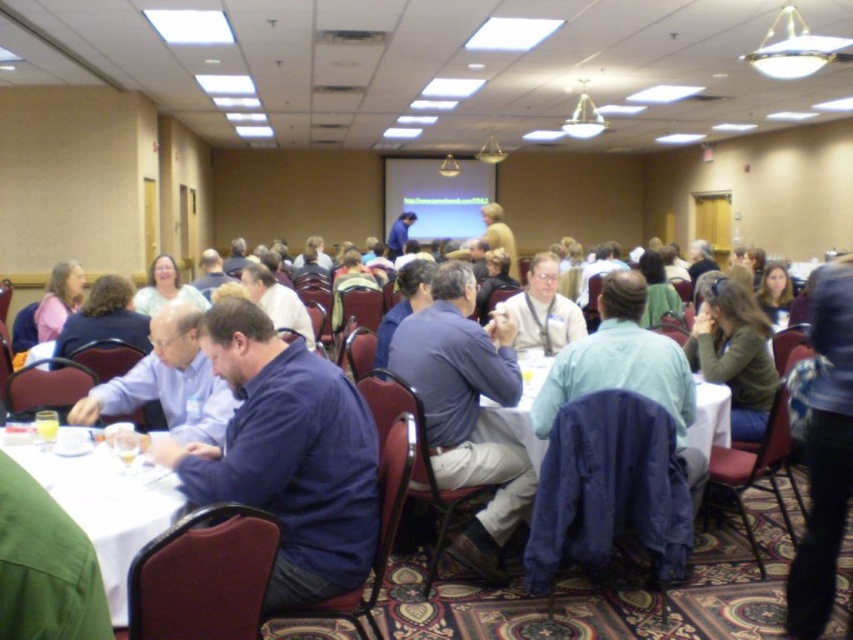
You are standing at the entrance of the conference room and see two points marked on the floor. The first point is labeled as point (120, 588) and the second is point (492, 436). If you want to walk from the entrance to the first point, will you pass by the second point on your way?

Since point (120, 588) is in front of point (492, 436), you will not pass by the second point on your way to the first point because the first point is closer to the entrance.

You are organizing a small group discussion and need to choose between the white glossy table at lower left and the white fabric table at center for seating 4 people. Based on their sizes, which table would be more suitable for accommodating everyone comfortably?

The white fabric table at center has a greater width than the white glossy table at lower left, making it more suitable for comfortably seating 4 people.

You are standing at the entrance of the conference room and see the point marked at coordinates (287, 456). What is the closest object to that point?

The closest object to the point marked at coordinates (287, 456) is the dark blue shirt at center.